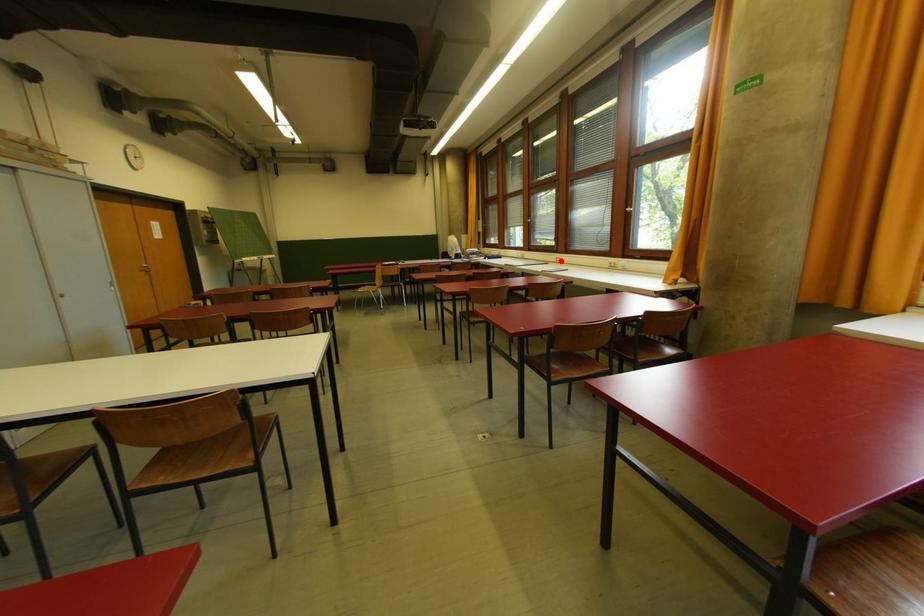
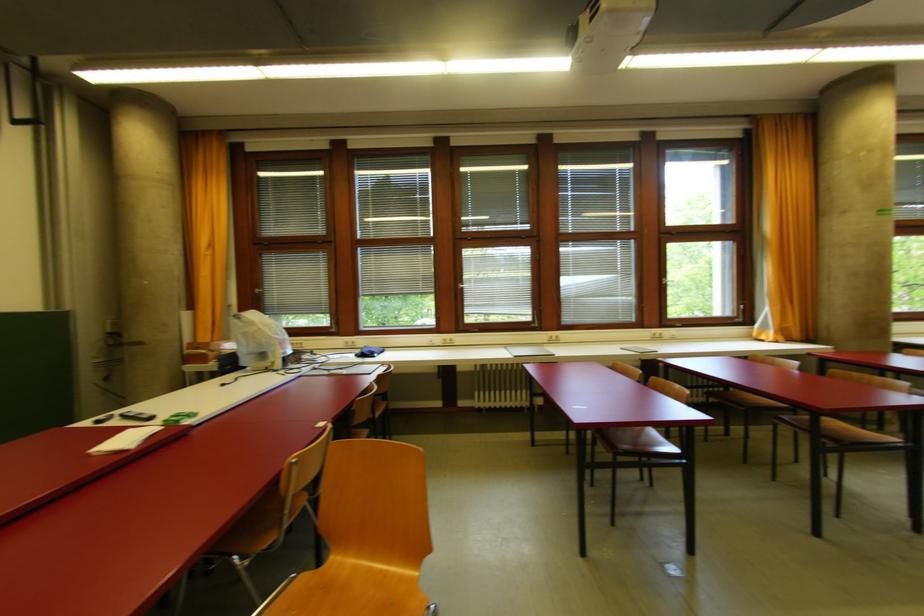
Question: I am providing you with two images of the same scene from different viewpoints. Given a red point in image1, look at the same physical point in image2. Is it:

Choices:
 (A) Closer to the viewpoint
 (B) Farther from the viewpoint

Answer: (B)